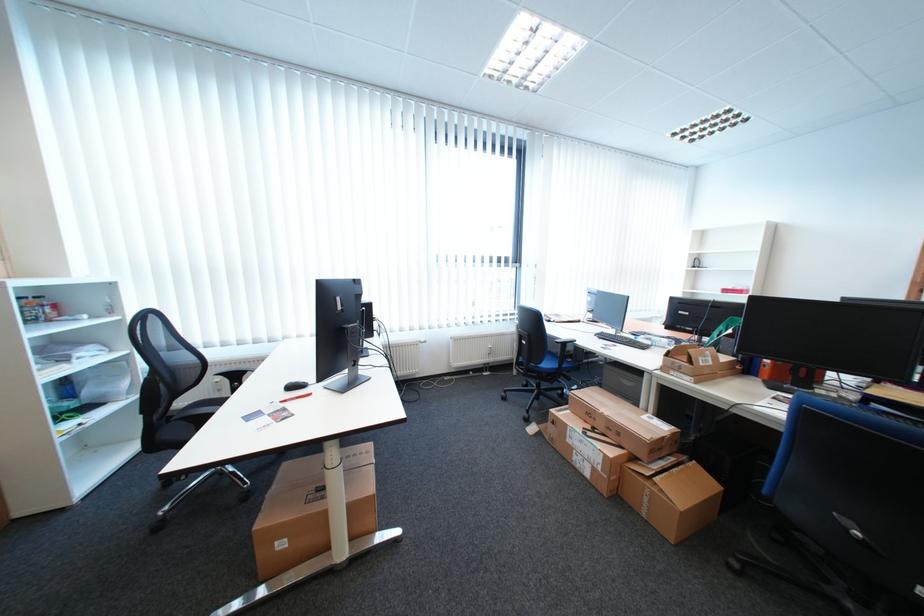
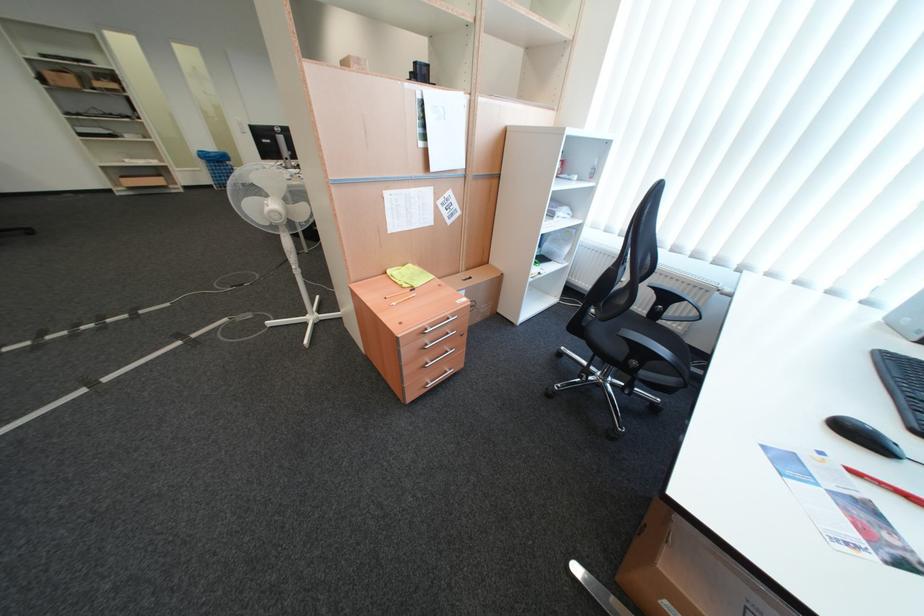
Locate, in the second image, the point that corresponds to point (244, 385) in the first image.

(667, 305)